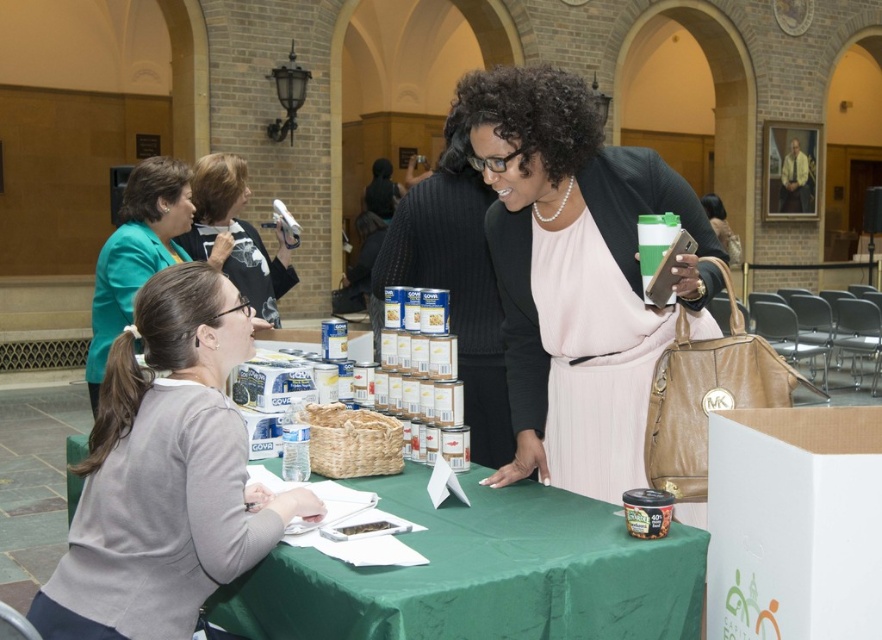
Who is shorter, teal fabric jacket at upper left or matte black camera at upper center?

matte black camera at upper center is shorter.

Who is positioned more to the left, teal fabric jacket at upper left or matte black camera at upper center?

From the viewer's perspective, teal fabric jacket at upper left appears more on the left side.

Does point (120, 301) come behind point (217, 216)?

No, (120, 301) is in front of (217, 216).

This screenshot has width=882, height=640. I want to click on teal fabric jacket at upper left, so click(136, 252).

Which is more to the left, gray sweater at lower left or matte black camera at upper center?

Positioned to the left is matte black camera at upper center.

The height and width of the screenshot is (640, 882). What do you see at coordinates (165, 474) in the screenshot?
I see `gray sweater at lower left` at bounding box center [165, 474].

You are a GUI agent. You are given a task and a screenshot of the screen. Output one action in this format:
    pyautogui.click(x=<x>, y=<y>)
    Task: Click on the gray sweater at lower left
    This screenshot has width=882, height=640.
    Given the screenshot: What is the action you would take?
    pyautogui.click(x=165, y=474)

Who is lower down, matte black jacket at center or teal fabric jacket at upper left?

Positioned lower is matte black jacket at center.

Can you confirm if matte black jacket at center is smaller than teal fabric jacket at upper left?

No, matte black jacket at center is not smaller than teal fabric jacket at upper left.

Which is behind, point (701, 326) or point (178, 216)?

Point (178, 216)

Locate an element on the screen. matte black jacket at center is located at coordinates (572, 275).